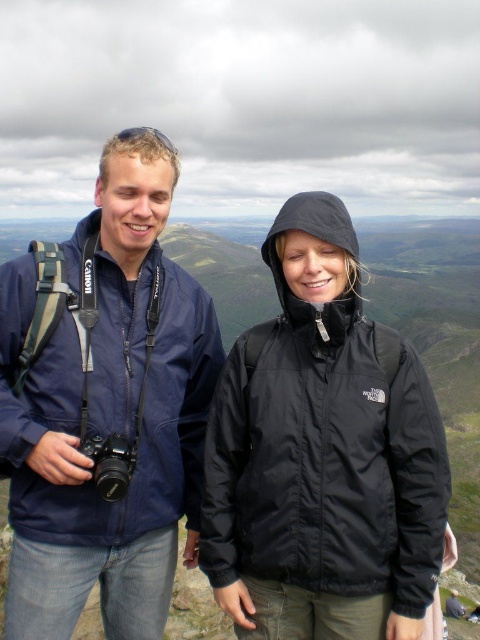
Question: Among these points, which one is farthest from the camera?

Choices:
 (A) (261, 547)
 (B) (109, 394)

Answer: (B)

Question: Among these points, which one is farthest from the camera?

Choices:
 (A) (304, 400)
 (B) (0, 273)

Answer: (B)

Question: Observing the image, what is the correct spatial positioning of matte blue jacket at left in reference to black/waterproof jacket at center?

Choices:
 (A) right
 (B) left

Answer: (B)

Question: In this image, where is matte blue jacket at left located relative to black/waterproof jacket at center?

Choices:
 (A) left
 (B) right

Answer: (A)

Question: Does matte blue jacket at left appear over black/waterproof jacket at center?

Choices:
 (A) yes
 (B) no

Answer: (B)

Question: Which object appears farthest from the camera in this image?

Choices:
 (A) black/waterproof jacket at center
 (B) matte blue jacket at left

Answer: (B)